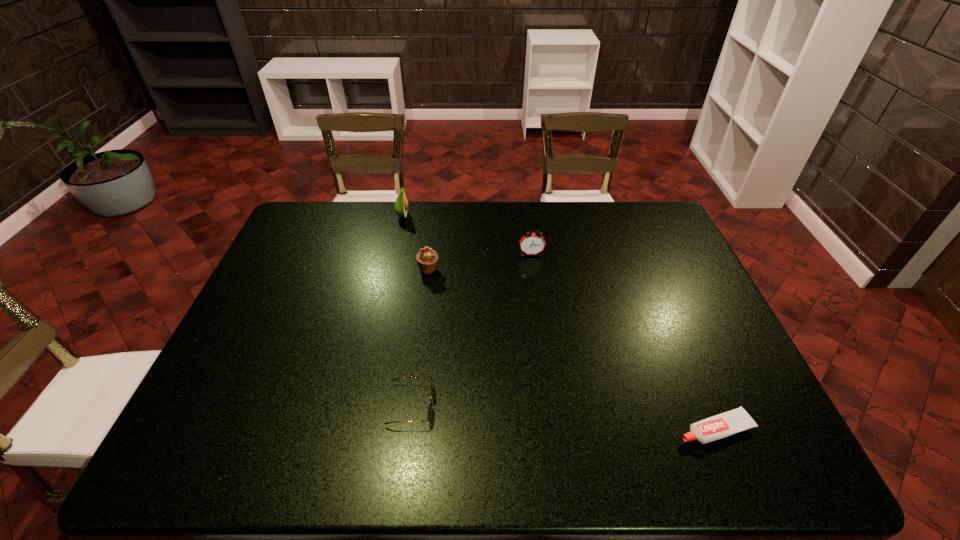
The height and width of the screenshot is (540, 960). In order to click on vacant space at the right edge in this screenshot , I will do `click(665, 309)`.

Where is `free space at the far left corner of the desktop`? This screenshot has width=960, height=540. free space at the far left corner of the desktop is located at coordinates point(322,217).

You are a GUI agent. You are given a task and a screenshot of the screen. Output one action in this format:
    pyautogui.click(x=<x>, y=<y>)
    Task: Click on the vacant space at the far right corner
    The height and width of the screenshot is (540, 960).
    Given the screenshot: What is the action you would take?
    pyautogui.click(x=643, y=213)

Locate an element on the screen. free space at the near right corner of the desktop is located at coordinates (726, 446).

Image resolution: width=960 pixels, height=540 pixels. I want to click on vacant point located between the fourth nearest object and the shortest object, so click(623, 341).

This screenshot has height=540, width=960. I want to click on vacant region between the fourth nearest object and the shortest object, so click(623, 341).

Locate an element on the screen. This screenshot has height=540, width=960. free space between the sunglasses and the muffin is located at coordinates (420, 337).

Image resolution: width=960 pixels, height=540 pixels. What are the coordinates of `free space between the second shortest object and the rightmost object` in the screenshot? It's located at pyautogui.click(x=564, y=416).

At what (x,y) coordinates should I click in order to perform the action: click on blank region between the muffin and the second object from right to left. Please return your answer as a coordinate pair (x, y). Looking at the image, I should click on pyautogui.click(x=480, y=262).

Where is `empty location between the third nearest object and the fourth object from left to right`? This screenshot has width=960, height=540. empty location between the third nearest object and the fourth object from left to right is located at coordinates (480, 262).